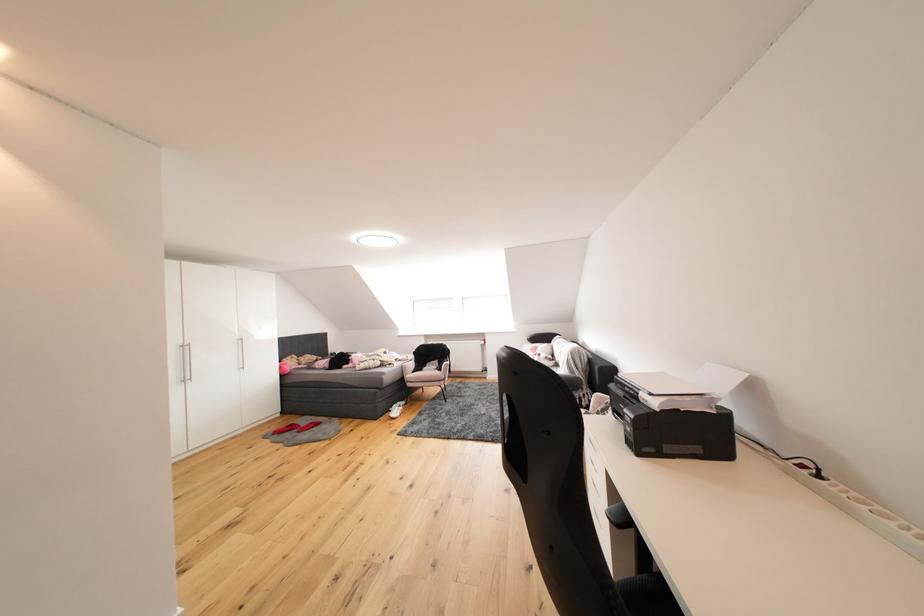
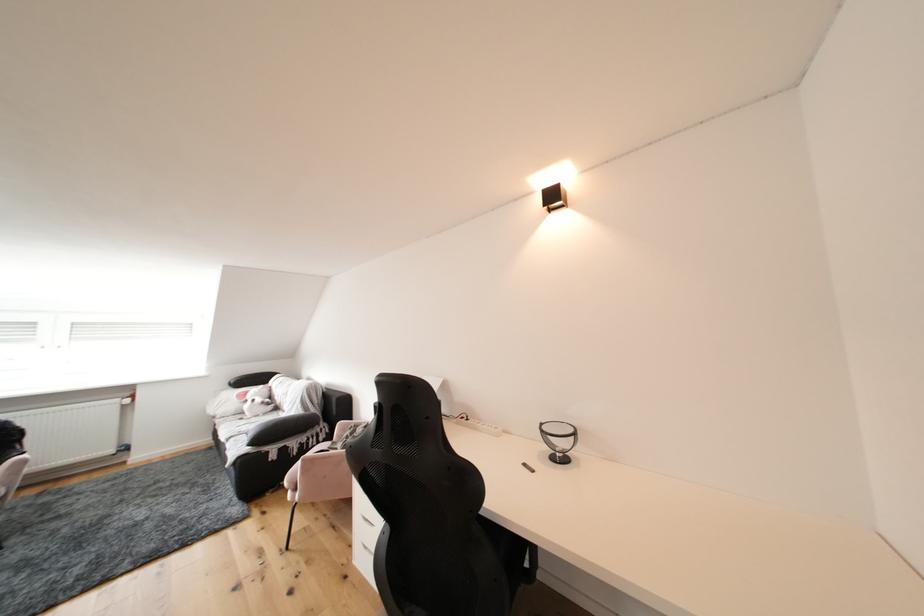
Where in the second image is the point corresponding to point (545, 352) from the first image?

(256, 397)